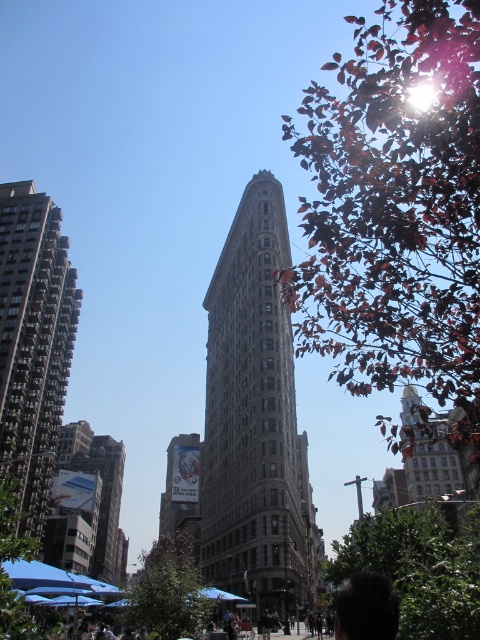
You are standing in the urban scene and want to take a photo of the Flatiron Building. Which tree, the green leafy tree at lower right or the green leafy tree at lower left, will block less of the view of the building?

The green leafy tree at lower right is not as tall as the green leafy tree at lower left, so it will block less of the view of the Flatiron Building.

You are a delivery drone that needs to deliver a package to the white glossy billboard at center. The billboard is located at coordinates point 0.766, 0.381. Your current position is at point 0.5, 0.5. Can you fly directly to the billboard without any obstacles? Please explain your reasoning based on the scene description.

The white glossy billboard at center is located at point (x=182, y=490). Since the scene description mentions trees with reddish brown leaves in the foreground below which are blue umbrellas, there might be obstacles between your current position at (x=240, y=320) and the billboard. However, the billboard is at the center, and the trees are in the foreground below the umbrellas. Without specific information about obstacles along the flight path, it is uncertain if there are any obstructions. Therefore, it is safer

You are standing in the middle of the scene and want to take a photo of the Flatiron Building. Which tree, the green leafy tree at lower right or the green leafy tree at lower left, is closer to you?

The green leafy tree at lower right is closer to you because it is positioned in front of the green leafy tree at lower left.